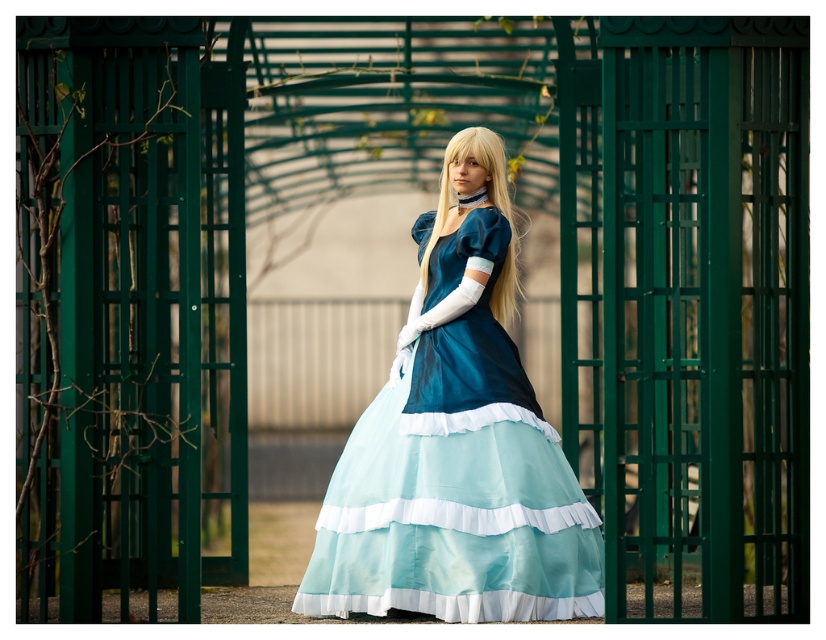
Question: In this image, where is matte blue dress at center located relative to blonde silky hair at center?

Choices:
 (A) above
 (B) below

Answer: (B)

Question: Which point is closer to the camera?

Choices:
 (A) (492, 132)
 (B) (509, 240)

Answer: (B)

Question: Is matte blue dress at center bigger than blonde silky hair at center?

Choices:
 (A) no
 (B) yes

Answer: (B)

Question: Among these objects, which one is farthest from the camera?

Choices:
 (A) matte blue dress at center
 (B) blonde silky hair at center

Answer: (B)

Question: Does matte blue dress at center have a lesser width compared to blonde silky hair at center?

Choices:
 (A) yes
 (B) no

Answer: (B)